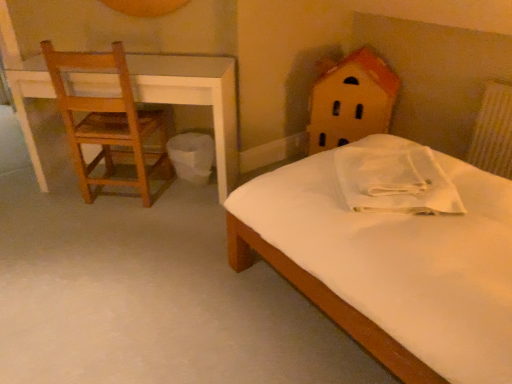
The width and height of the screenshot is (512, 384). Find the location of `space that is in front of wooden chair at left`. space that is in front of wooden chair at left is located at coordinates [114, 232].